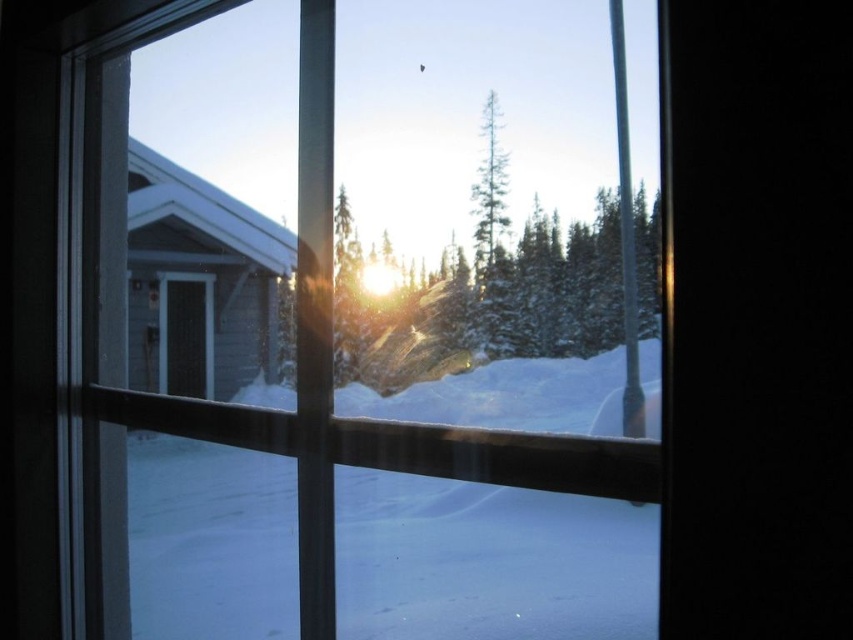
Question: Is transparent glass window at center positioned behind green matte tree at center?

Choices:
 (A) no
 (B) yes

Answer: (A)

Question: Which point is closer to the camera?

Choices:
 (A) tap(271, 204)
 (B) tap(492, 195)

Answer: (A)

Question: From the image, what is the correct spatial relationship of transparent glass window at center in relation to green matte tree at center?

Choices:
 (A) right
 (B) left

Answer: (A)

Question: Is transparent glass window at center to the right of green matte tree at center from the viewer's perspective?

Choices:
 (A) yes
 (B) no

Answer: (A)

Question: Among these points, which one is nearest to the camera?

Choices:
 (A) (334, 296)
 (B) (498, 120)

Answer: (A)